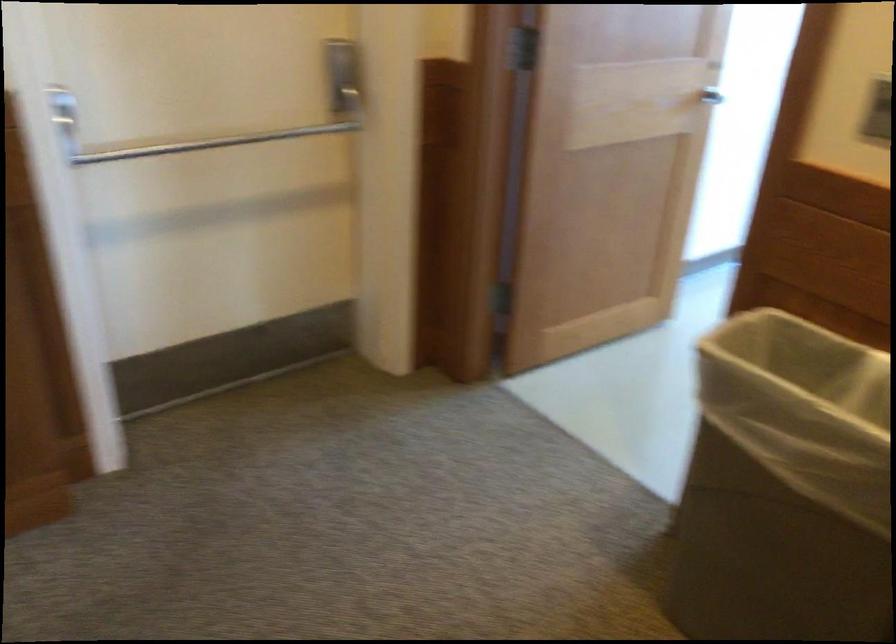
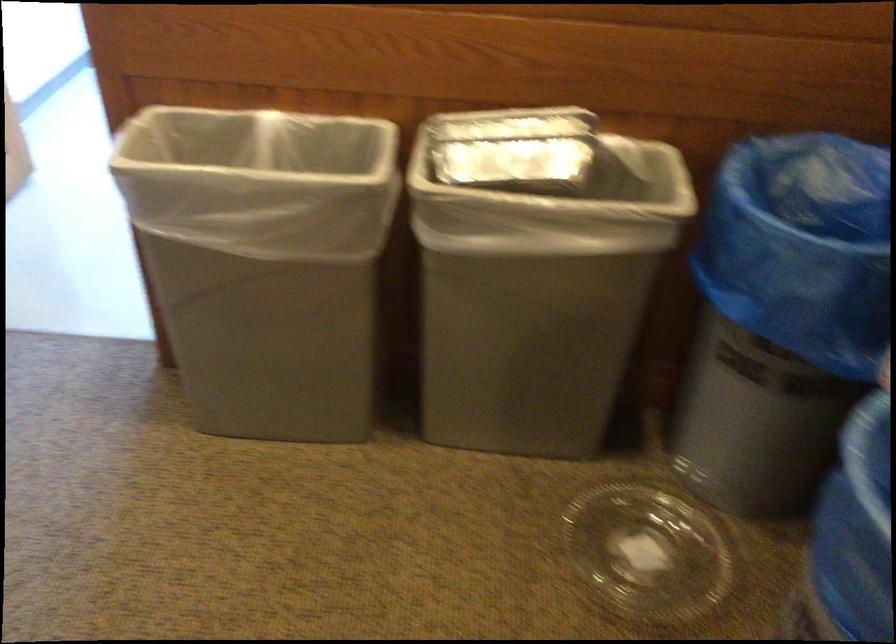
Where in the second image is the point corresponding to (x=806, y=488) from the first image?

(263, 261)